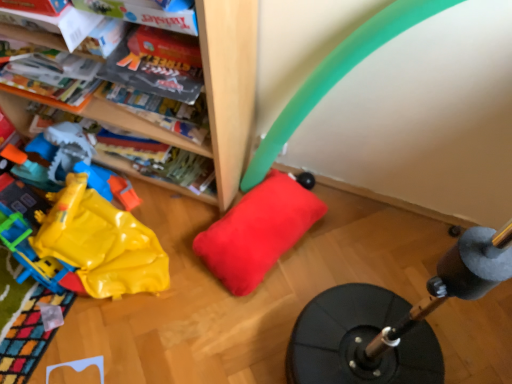
Question: Would you say rubber/yellow at left is inside or outside red plush pillow at center?

Choices:
 (A) outside
 (B) inside

Answer: (A)

Question: From their relative heights in the image, would you say rubber/yellow at left is taller or shorter than red plush pillow at center?

Choices:
 (A) short
 (B) tall

Answer: (B)

Question: Considering the relative positions of rubber/yellow at left and red plush pillow at center in the image provided, is rubber/yellow at left to the left or to the right of red plush pillow at center?

Choices:
 (A) right
 (B) left

Answer: (B)

Question: From the image's perspective, is red plush pillow at center positioned above or below rubber/yellow at left?

Choices:
 (A) below
 (B) above

Answer: (A)

Question: Is red plush pillow at center wider or thinner than rubber/yellow at left?

Choices:
 (A) wide
 (B) thin

Answer: (B)

Question: Is point (268, 198) closer or farther from the camera than point (13, 251)?

Choices:
 (A) farther
 (B) closer

Answer: (A)

Question: Choose the correct answer: Is red plush pillow at center inside rubber/yellow at left or outside it?

Choices:
 (A) inside
 (B) outside

Answer: (B)